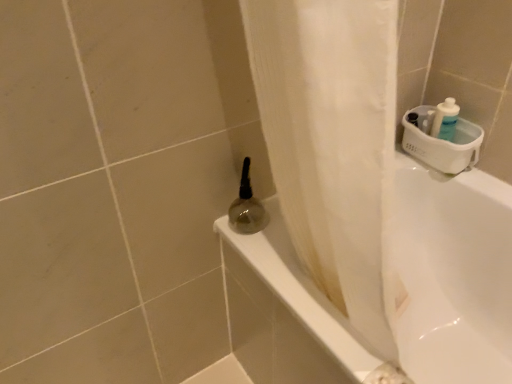
Locate an element on the screen. translucent glass bottle at upper center is located at coordinates (247, 207).

Describe the element at coordinates (247, 207) in the screenshot. I see `translucent glass bottle at upper center` at that location.

The image size is (512, 384). In order to click on white glossy bathtub at lower right in this screenshot , I will do (x=452, y=276).

What do you see at coordinates (452, 276) in the screenshot? The height and width of the screenshot is (384, 512). I see `white glossy bathtub at lower right` at bounding box center [452, 276].

In order to click on translucent glass bottle at upper center in this screenshot , I will do `click(247, 207)`.

Does translucent glass bottle at upper center appear on the right side of white glossy bathtub at lower right?

In fact, translucent glass bottle at upper center is to the left of white glossy bathtub at lower right.

Is translucent glass bottle at upper center in front of or behind white glossy bathtub at lower right in the image?

translucent glass bottle at upper center is behind white glossy bathtub at lower right.

Between point (234, 205) and point (332, 333), which one is positioned behind?

The point (234, 205) is farther from the camera.

From the image's perspective, is translucent glass bottle at upper center above white glossy bathtub at lower right?

Yes.

From a real-world perspective, which is physically below, translucent glass bottle at upper center or white glossy bathtub at lower right?

In real-world perspective, white glossy bathtub at lower right is lower.

Is translucent glass bottle at upper center wider or thinner than white glossy bathtub at lower right?

Clearly, translucent glass bottle at upper center has less width compared to white glossy bathtub at lower right.

Is translucent glass bottle at upper center shorter than white glossy bathtub at lower right?

Correct, translucent glass bottle at upper center is not as tall as white glossy bathtub at lower right.

Can you confirm if translucent glass bottle at upper center is smaller than white glossy bathtub at lower right?

Yes.

Do you think translucent glass bottle at upper center is within white glossy bathtub at lower right, or outside of it?

The correct answer is: outside.

Is translucent glass bottle at upper center touching white glossy bathtub at lower right?

No, translucent glass bottle at upper center is not in contact with white glossy bathtub at lower right.

Is translucent glass bottle at upper center turned away from white glossy bathtub at lower right?

translucent glass bottle at upper center does not have its back to white glossy bathtub at lower right.

How far apart are translucent glass bottle at upper center and white glossy bathtub at lower right?

translucent glass bottle at upper center is 22.56 inches from white glossy bathtub at lower right.

Where is `bathtub beneath the translucent glass bottle at upper center (from a real-world perspective)`? This screenshot has height=384, width=512. bathtub beneath the translucent glass bottle at upper center (from a real-world perspective) is located at coordinates (452, 276).

Can you confirm if white glossy bathtub at lower right is positioned to the right of translucent glass bottle at upper center?

Correct, you'll find white glossy bathtub at lower right to the right of translucent glass bottle at upper center.

Is the position of white glossy bathtub at lower right less distant than that of translucent glass bottle at upper center?

Yes, it is.

Is point (238, 325) behind point (251, 196)?

Yes, point (238, 325) is farther from viewer.

From the image's perspective, is white glossy bathtub at lower right positioned above or below translucent glass bottle at upper center?

Clearly, from the image's perspective, white glossy bathtub at lower right is below translucent glass bottle at upper center.

From a real-world perspective, which is physically above, white glossy bathtub at lower right or translucent glass bottle at upper center?

translucent glass bottle at upper center, from a real-world perspective.

Does white glossy bathtub at lower right have a greater width compared to translucent glass bottle at upper center?

Yes, white glossy bathtub at lower right is wider than translucent glass bottle at upper center.

In terms of height, does white glossy bathtub at lower right look taller or shorter compared to translucent glass bottle at upper center?

In the image, white glossy bathtub at lower right appears to be taller than translucent glass bottle at upper center.

Who is smaller, white glossy bathtub at lower right or translucent glass bottle at upper center?

With smaller size is translucent glass bottle at upper center.

In the scene shown: Is white glossy bathtub at lower right positioned beyond the bounds of translucent glass bottle at upper center?

Yes, white glossy bathtub at lower right is not within translucent glass bottle at upper center.

Are white glossy bathtub at lower right and translucent glass bottle at upper center located far from each other?

white glossy bathtub at lower right is near translucent glass bottle at upper center, not far away.

Is white glossy bathtub at lower right facing away from translucent glass bottle at upper center?

white glossy bathtub at lower right is not turned away from translucent glass bottle at upper center.

Measure the distance from white glossy bathtub at lower right to translucent glass bottle at upper center.

white glossy bathtub at lower right and translucent glass bottle at upper center are 22.56 inches apart from each other.

Where is `mouthwash that is on the left side of white glossy bathtub at lower right`? The image size is (512, 384). mouthwash that is on the left side of white glossy bathtub at lower right is located at coordinates (247, 207).

Find the location of a particular element. mouthwash located above the white glossy bathtub at lower right (from the image's perspective) is located at coordinates (x=247, y=207).

You are a GUI agent. You are given a task and a screenshot of the screen. Output one action in this format:
    pyautogui.click(x=<x>, y=<y>)
    Task: Click on the mouthwash that appears above the white glossy bathtub at lower right (from a real-world perspective)
    
    Given the screenshot: What is the action you would take?
    pyautogui.click(x=247, y=207)